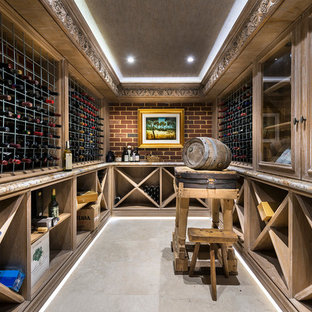
Identify the location of lighting. (130, 59), (189, 59).